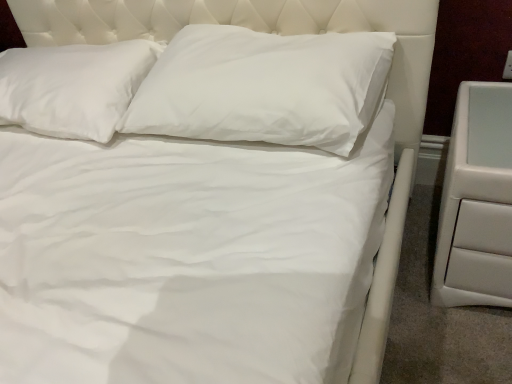
Question: Does white leather nightstand at right touch white soft pillow at upper center, the 1th pillow when ordered from left to right?

Choices:
 (A) no
 (B) yes

Answer: (A)

Question: Considering the relative positions of white leather nightstand at right and white soft pillow at upper center, the 1th pillow when ordered from left to right, in the image provided, is white leather nightstand at right to the left of white soft pillow at upper center, the 1th pillow when ordered from left to right, from the viewer's perspective?

Choices:
 (A) yes
 (B) no

Answer: (B)

Question: Can white soft pillow at upper center, the 2th pillow in the right-to-left sequence, be found inside white leather nightstand at right?

Choices:
 (A) yes
 (B) no

Answer: (B)

Question: Can you confirm if white leather nightstand at right is taller than white soft pillow at upper center, the 2th pillow in the right-to-left sequence?

Choices:
 (A) no
 (B) yes

Answer: (B)

Question: Is white leather nightstand at right thinner than white soft pillow at upper center, the 2th pillow in the right-to-left sequence?

Choices:
 (A) no
 (B) yes

Answer: (A)

Question: From a real-world perspective, is white leather nightstand at right on top of white soft pillow at upper center, the 1th pillow when ordered from left to right?

Choices:
 (A) yes
 (B) no

Answer: (B)

Question: Is the depth of white leather nightstand at right greater than that of white smooth pillow at center, which is the 1th pillow from right to left?

Choices:
 (A) yes
 (B) no

Answer: (B)

Question: From a real-world perspective, does white leather nightstand at right stand above white smooth pillow at center, positioned as the second pillow in left-to-right order?

Choices:
 (A) yes
 (B) no

Answer: (B)

Question: Is white smooth pillow at center, positioned as the second pillow in left-to-right order, surrounded by white leather nightstand at right?

Choices:
 (A) no
 (B) yes

Answer: (A)

Question: Is white leather nightstand at right facing towards white smooth pillow at center, which is the 1th pillow from right to left?

Choices:
 (A) no
 (B) yes

Answer: (A)

Question: Is white leather nightstand at right completely or partially outside of white smooth pillow at center, positioned as the second pillow in left-to-right order?

Choices:
 (A) yes
 (B) no

Answer: (A)

Question: Is white leather nightstand at right at the right side of white smooth pillow at center, which is the 1th pillow from right to left?

Choices:
 (A) no
 (B) yes

Answer: (B)

Question: From the image's perspective, would you say white soft pillow at upper center, the 1th pillow when ordered from left to right, is positioned over white leather nightstand at right?

Choices:
 (A) no
 (B) yes

Answer: (B)